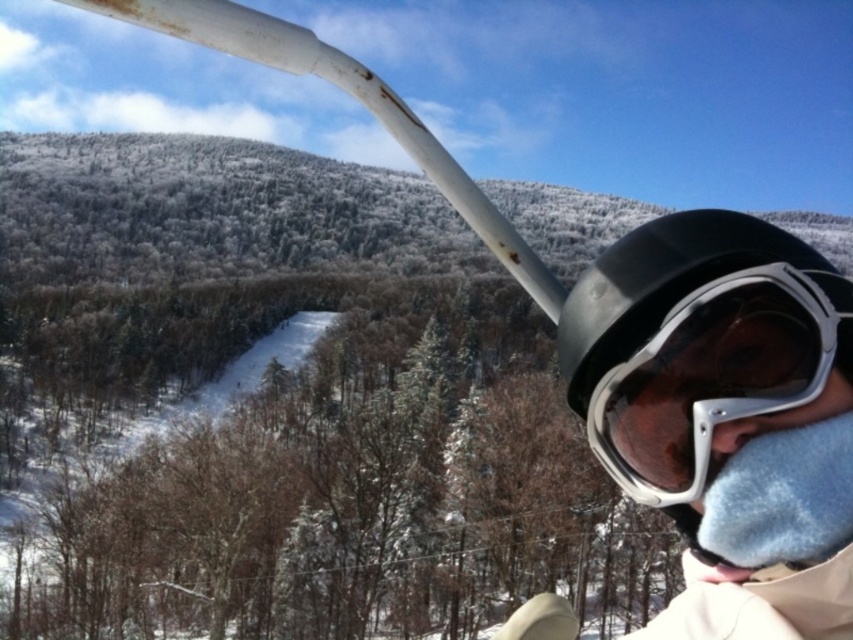
How distant is matte black goggles at right from matte white nose at lower center?

They are 24.36 inches apart.

Does matte black goggles at right have a greater height compared to matte white nose at lower center?

Indeed, matte black goggles at right has a greater height compared to matte white nose at lower center.

At what (x,y) coordinates should I click in order to perform the action: click on matte black goggles at right. Please return your answer as a coordinate pair (x, y). This screenshot has height=640, width=853. Looking at the image, I should click on (717, 374).

At what (x,y) coordinates should I click in order to perform the action: click on matte black goggles at right. Please return your answer as a coordinate pair (x, y). The height and width of the screenshot is (640, 853). Looking at the image, I should click on (717, 374).